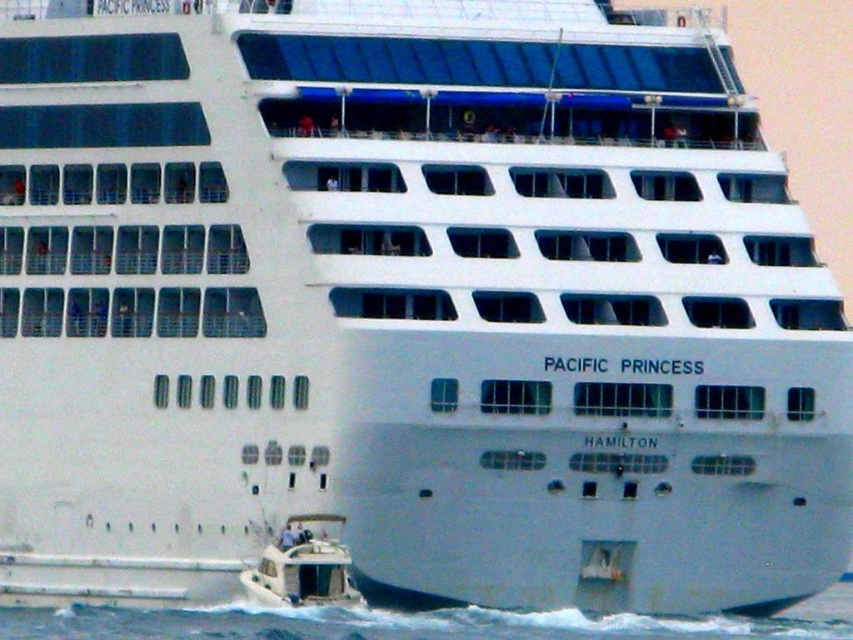
Can you confirm if blue water at lower left is shorter than white glossy motorboat at lower left?

No.

Is point (265, 612) in front of point (248, 588)?

Yes, point (265, 612) is in front of point (248, 588).

Which is behind, point (9, 620) or point (254, 570)?

Point (9, 620)

The image size is (853, 640). I want to click on blue water at lower left, so click(419, 624).